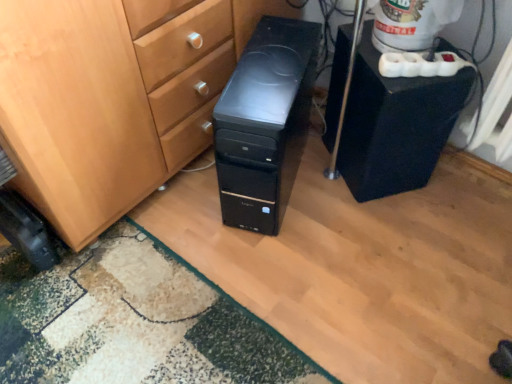
The height and width of the screenshot is (384, 512). Identify the location of vacant space positioned to the left of black plastic computer tower at center. (176, 209).